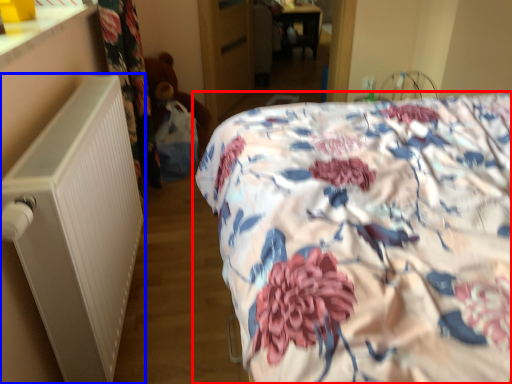
Question: Which point is further to the camera, bed (highlighted by a red box) or radiator (highlighted by a blue box)?

Choices:
 (A) bed
 (B) radiator

Answer: (B)